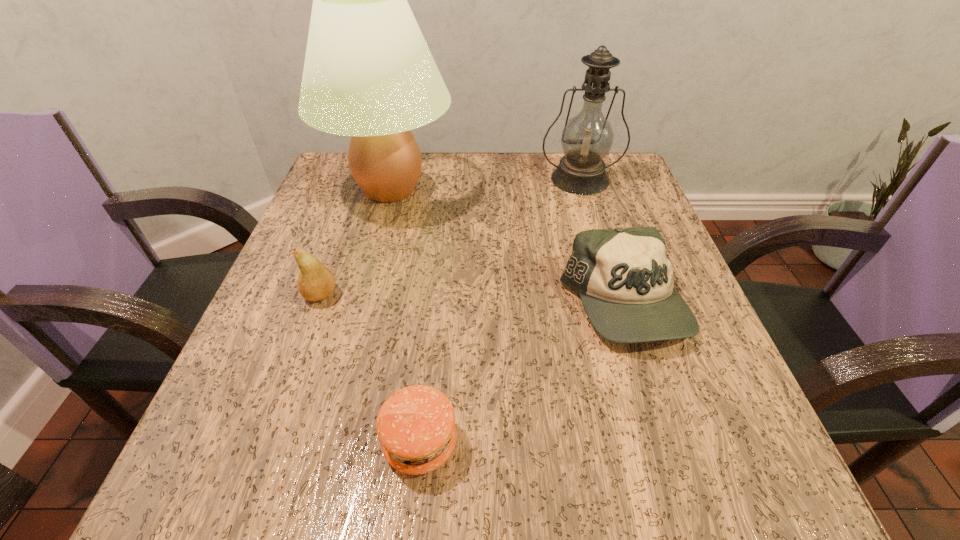
The image size is (960, 540). Identify the location of vacant space in between the pear and the baseball cap. (472, 300).

Find the location of `unoccupied area between the lampshade and the oil lamp`. unoccupied area between the lampshade and the oil lamp is located at coordinates (485, 184).

The image size is (960, 540). I want to click on free space between the baseball cap and the pear, so click(472, 300).

In order to click on vacant area that lies between the lampshade and the oil lamp in this screenshot , I will do `click(485, 184)`.

Image resolution: width=960 pixels, height=540 pixels. I want to click on vacant space in between the lampshade and the pear, so click(355, 242).

What are the coordinates of `vacant area that lies between the lampshade and the oil lamp` in the screenshot? It's located at (485, 184).

Identify the location of object that ranks as the second closest to the baseball cap. The height and width of the screenshot is (540, 960). (368, 73).

Where is `the third closest object to the baseball cap`? This screenshot has width=960, height=540. the third closest object to the baseball cap is located at coordinates (587, 138).

This screenshot has height=540, width=960. Find the location of `vacant space that satisfies the following two spatial constraints: 1. on the front side of the nearest object; 2. on the right side of the pear`. vacant space that satisfies the following two spatial constraints: 1. on the front side of the nearest object; 2. on the right side of the pear is located at coordinates (268, 443).